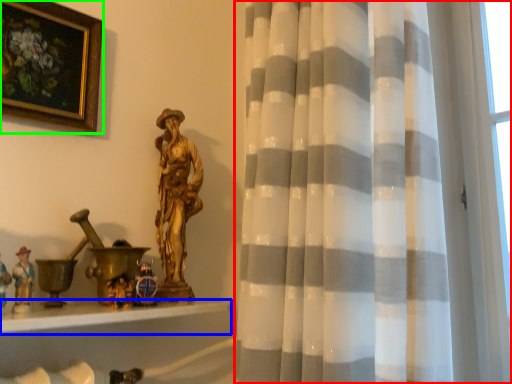
Question: Considering the real-world distances, which object is closest to curtain (highlighted by a red box)? window sill (highlighted by a blue box) or picture frame (highlighted by a green box).

Choices:
 (A) window sill
 (B) picture frame

Answer: (A)